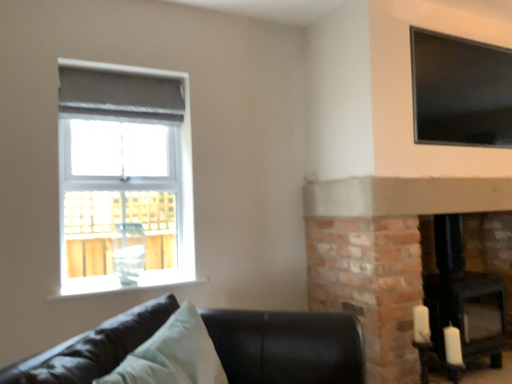
Where is `vacant region above transparent glass window at upper right, marked as the second window in a left-to-right arrangement (from a real-world perspective)`? The width and height of the screenshot is (512, 384). vacant region above transparent glass window at upper right, marked as the second window in a left-to-right arrangement (from a real-world perspective) is located at coordinates (457, 37).